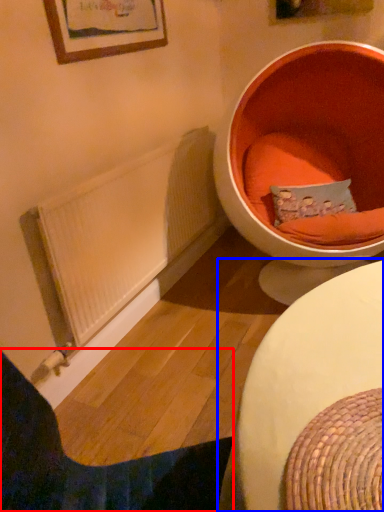
Question: Which point is closer to the camera, furniture (highlighted by a red box) or table (highlighted by a blue box)?

Choices:
 (A) furniture
 (B) table

Answer: (B)